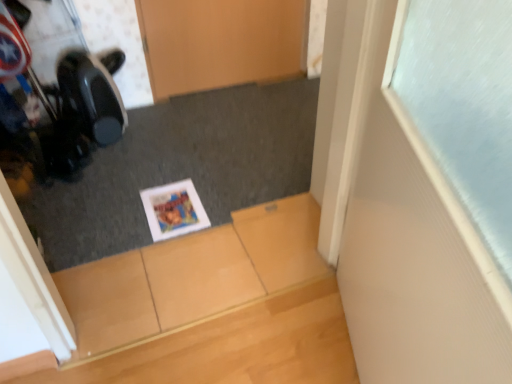
What do you see at coordinates (174, 210) in the screenshot? I see `matte paper magazine at center` at bounding box center [174, 210].

I want to click on matte paper magazine at center, so click(x=174, y=210).

The image size is (512, 384). Identify the location of matte paper magazine at center. (174, 210).